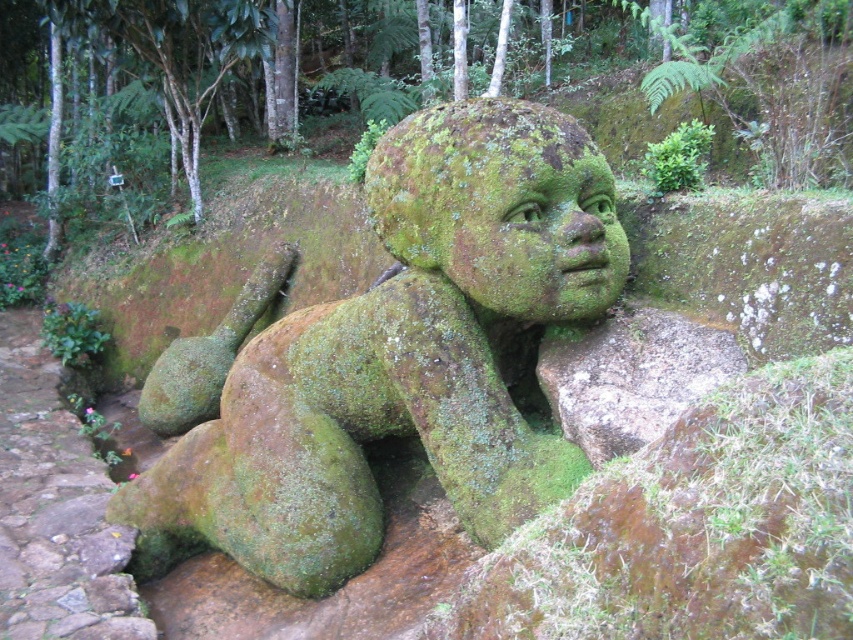
Question: Is brown stone path at lower left positioned at the back of green mossy rock at lower center?

Choices:
 (A) no
 (B) yes

Answer: (B)

Question: Which object is the farthest from the green mossy head at center?

Choices:
 (A) green mossy statue at center
 (B) brown stone path at lower left
 (C) green mossy rock at lower center

Answer: (B)

Question: Which object appears farthest from the camera in this image?

Choices:
 (A) green mossy rock at lower center
 (B) green mossy statue at center

Answer: (B)

Question: Does green mossy statue at center have a larger size compared to green mossy rock at lower center?

Choices:
 (A) yes
 (B) no

Answer: (A)

Question: Can you confirm if green mossy statue at center is positioned above brown stone path at lower left?

Choices:
 (A) yes
 (B) no

Answer: (A)

Question: Based on their relative distances, which object is nearer to the brown stone path at lower left?

Choices:
 (A) green mossy head at center
 (B) green mossy rock at lower center
 (C) green mossy statue at center

Answer: (C)